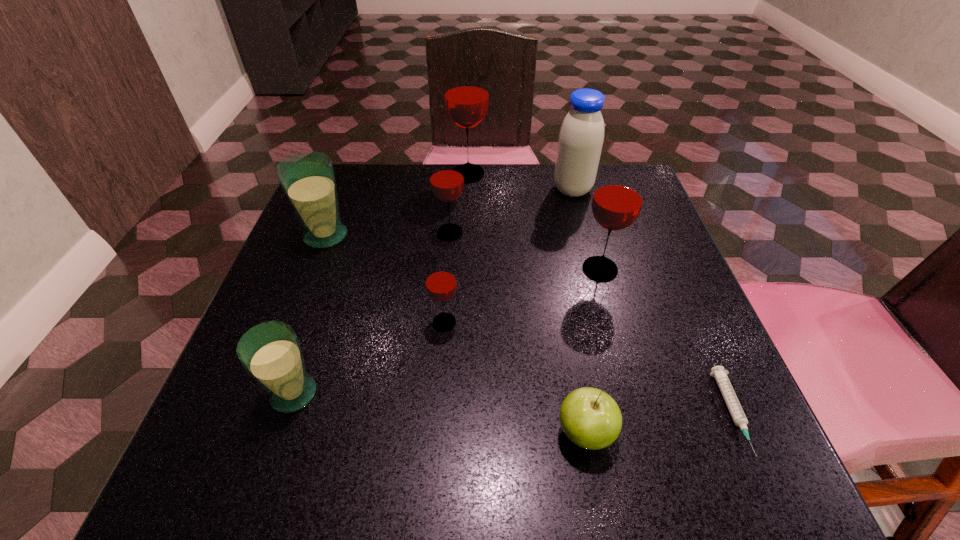
Find the location of a particular element. The image size is (960, 540). free point between the second nearest red glass and the bigger blue glass is located at coordinates (463, 253).

This screenshot has height=540, width=960. I want to click on vacant point located between the second nearest glass and the blue soya milk, so click(509, 256).

Image resolution: width=960 pixels, height=540 pixels. I want to click on free spot between the tallest glass and the third biggest red glass, so click(x=459, y=203).

I want to click on vacant region between the rightmost object and the nearest glass, so click(514, 403).

Image resolution: width=960 pixels, height=540 pixels. Find the location of `vacant region between the second nearest glass and the smaller blue glass`. vacant region between the second nearest glass and the smaller blue glass is located at coordinates (370, 358).

At what (x,y) coordinates should I click in order to perform the action: click on vacant space that's between the second biggest red glass and the rightmost object. Please return your answer as a coordinate pair (x, y). The image size is (960, 540). Looking at the image, I should click on (666, 341).

You are a GUI agent. You are given a task and a screenshot of the screen. Output one action in this format:
    pyautogui.click(x=<x>, y=<y>)
    Task: Click on the blank region between the smallest red glass and the farthest glass
    Image resolution: width=960 pixels, height=540 pixels.
    Given the screenshot: What is the action you would take?
    pyautogui.click(x=456, y=248)

The height and width of the screenshot is (540, 960). Identify the location of free spot between the smaller blue glass and the smallest red glass. (370, 358).

Identify the location of vacant area that lies between the second nearest red glass and the soya milk. This screenshot has height=540, width=960. (587, 230).

The image size is (960, 540). What are the coordinates of `the third closest object to the rightmost glass` in the screenshot? It's located at (446, 173).